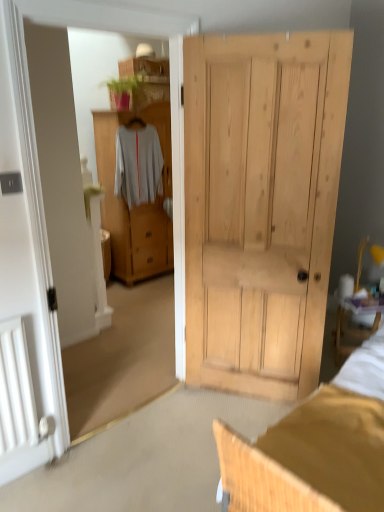
Question: Is white matte sweater at center in front of or behind light brown wood cabinet at center in the image?

Choices:
 (A) front
 (B) behind

Answer: (A)

Question: Looking at the image, does white matte sweater at center seem bigger or smaller compared to light brown wood cabinet at center?

Choices:
 (A) small
 (B) big

Answer: (A)

Question: From a real-world perspective, is white matte sweater at center physically located above or below light brown wood cabinet at center?

Choices:
 (A) above
 (B) below

Answer: (A)

Question: From a real-world perspective, is light brown wood cabinet at center above or below white matte sweater at center?

Choices:
 (A) above
 (B) below

Answer: (B)

Question: Considering the positions of point (99, 135) and point (144, 195), is point (99, 135) closer or farther from the camera than point (144, 195)?

Choices:
 (A) closer
 (B) farther

Answer: (A)

Question: From the image's perspective, is light brown wood cabinet at center positioned above or below white matte sweater at center?

Choices:
 (A) below
 (B) above

Answer: (A)

Question: In terms of size, does light brown wood cabinet at center appear bigger or smaller than white matte sweater at center?

Choices:
 (A) big
 (B) small

Answer: (A)